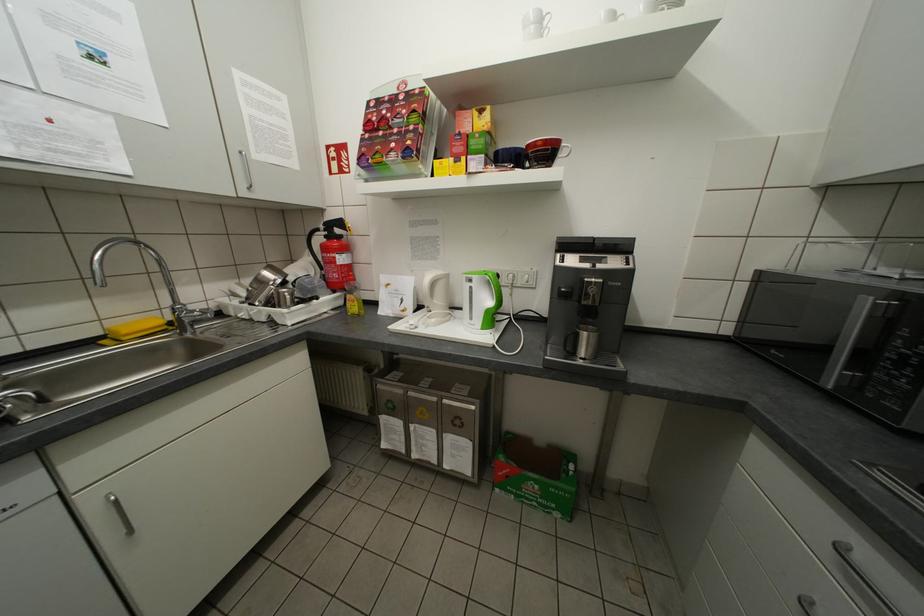
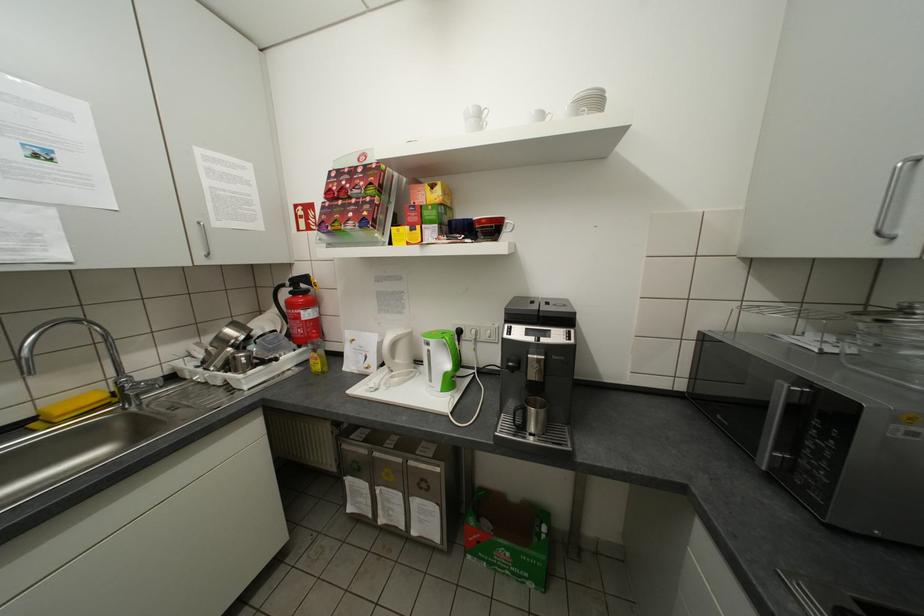
In the second image, find the point that corresponds to (565,492) in the first image.

(537, 560)